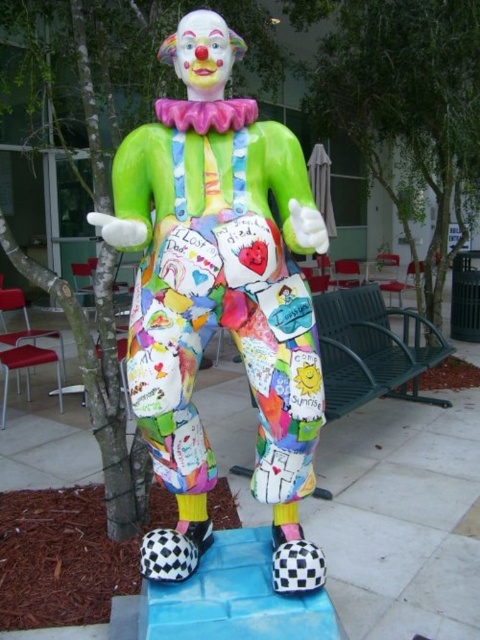
You are standing in a plaza and see the matte plastic clown at center. If you want to touch the clown, will you be able to reach it from where you are standing?

The matte plastic clown at center is 1.12 meters away from the viewer, so you can reach it since the distance is within arm length.

You are a landscape architect designing a new public plaza. You have to place a new bench exactly halfway between the matte plastic clown at center and the green leafy tree at center. Given their widths, will the bench be closer to the clown or the tree?

The bench will be closer to the matte plastic clown at center because its width is smaller than the green leafy tree at center, so the midpoint between them would be nearer to the clown.

You are standing in front of the clown statue and notice two points marked on its pants. The first point is at coordinate (191, 13) and the second at (372, 76). Which point is closer to you?

Point (191, 13) is closer to the camera than point (372, 76), so the first point is closer to you.